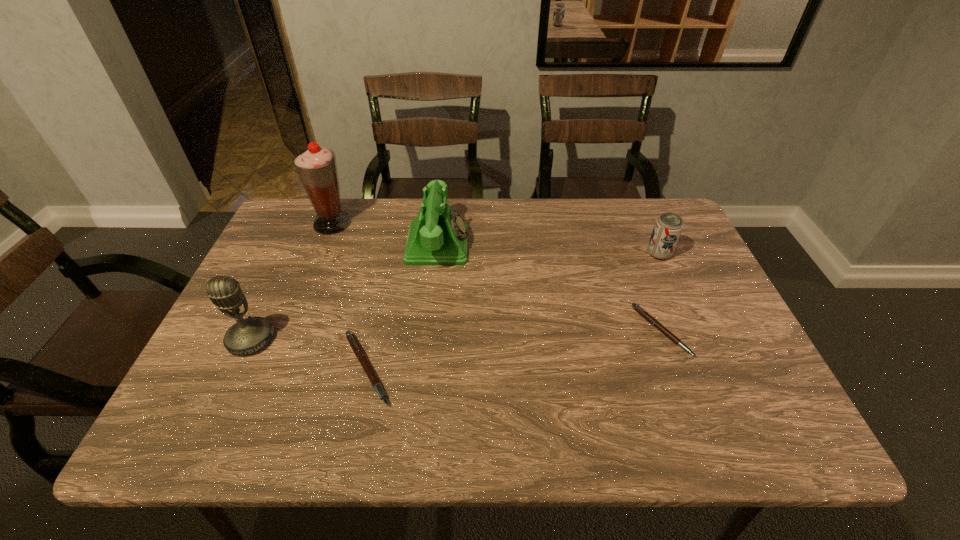
Identify the location of vacant space located 0.320m on the right of the tallest object. (455, 223).

Image resolution: width=960 pixels, height=540 pixels. Identify the location of vacant area situated 0.150m on the dial of the telephone. (520, 245).

Find the location of `free region located on the left of the beer can`. free region located on the left of the beer can is located at coordinates (523, 254).

Locate an element on the screen. smoothie that is at the far edge is located at coordinates (x=316, y=166).

The width and height of the screenshot is (960, 540). Find the location of `telephone at the far edge`. telephone at the far edge is located at coordinates (437, 236).

This screenshot has width=960, height=540. Identify the location of beer can located in the far edge section of the desktop. (668, 227).

What are the coordinates of `object present at the near edge` in the screenshot? It's located at (358, 351).

Locate an element on the screen. The height and width of the screenshot is (540, 960). smoothie that is at the left edge is located at coordinates (316, 166).

Find the location of a particular element. microphone at the left edge is located at coordinates (250, 335).

Image resolution: width=960 pixels, height=540 pixels. What are the coordinates of `pen positioned at the right edge` in the screenshot? It's located at click(637, 308).